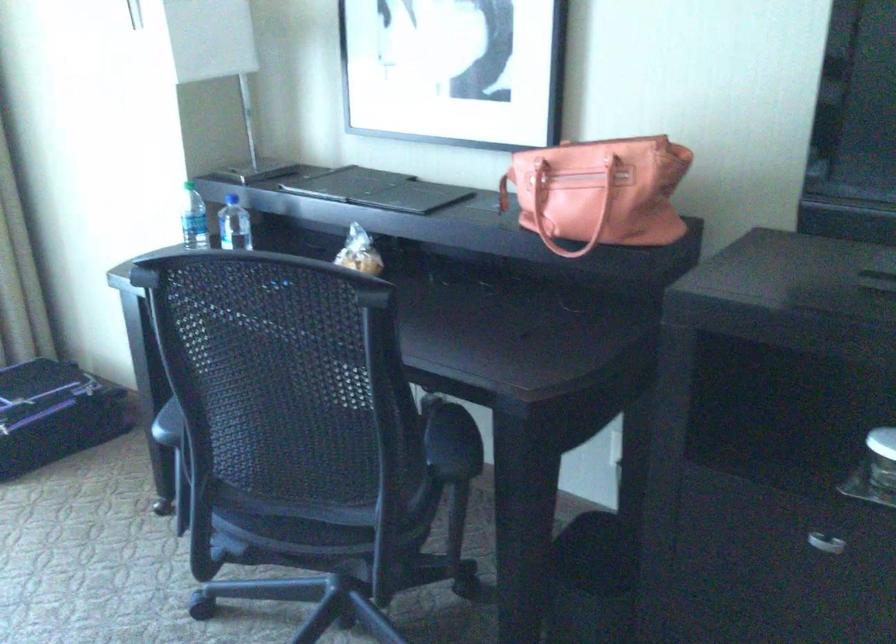
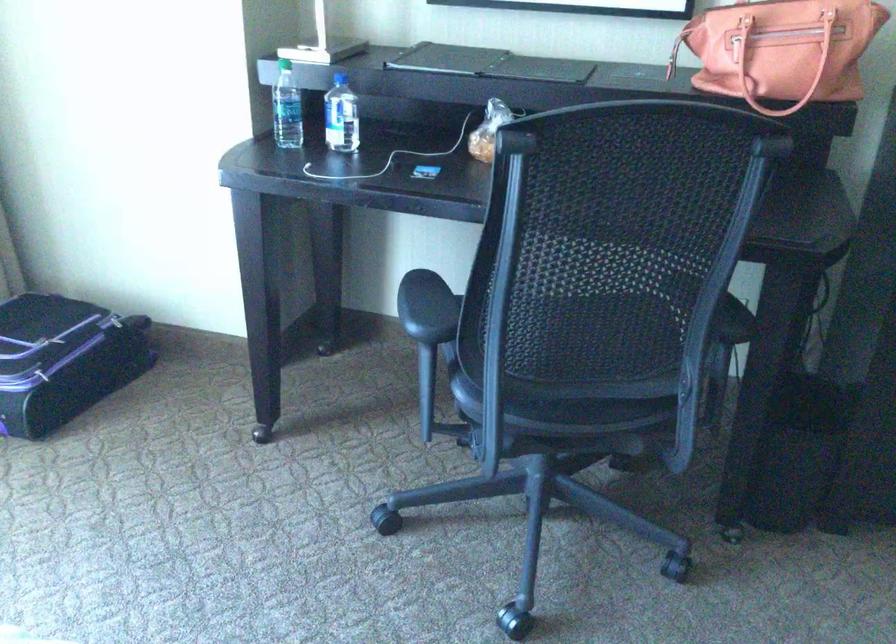
Question: What movement of the cameraman would produce the second image?

Choices:
 (A) Left
 (B) Right
 (C) Forward
 (D) Backward

Answer: (A)